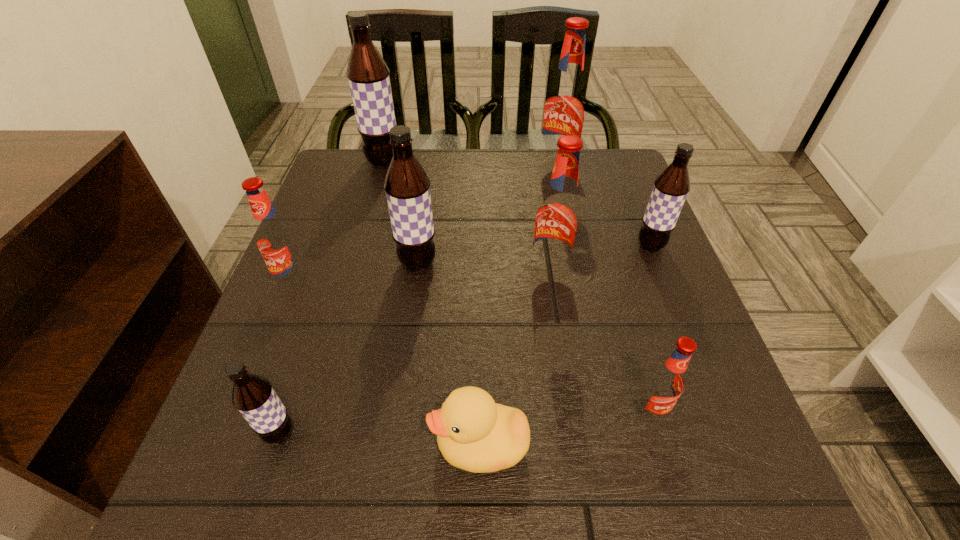
What are the coordinates of `free spot at the right edge of the desktop` in the screenshot? It's located at (695, 318).

The width and height of the screenshot is (960, 540). What are the coordinates of `free space at the far left corner` in the screenshot? It's located at (340, 198).

The height and width of the screenshot is (540, 960). Find the location of `vacant region at the far right corner of the desktop`. vacant region at the far right corner of the desktop is located at coordinates (619, 163).

Identify the location of free space that is in between the second smallest red root beer and the nearest red root beer. The image size is (960, 540). (472, 347).

You are a GUI agent. You are given a task and a screenshot of the screen. Output one action in this format:
    pyautogui.click(x=<x>, y=<y>)
    Task: Click on the vacant region between the yellow duck and the biggest brown root beer
    
    Given the screenshot: What is the action you would take?
    pyautogui.click(x=432, y=303)

I want to click on free space between the third smallest brown root beer and the third smallest red root beer, so click(x=484, y=268).

Where is `free area in between the farthest red root beer and the biggest brown root beer`? This screenshot has height=540, width=960. free area in between the farthest red root beer and the biggest brown root beer is located at coordinates [x=470, y=165].

Locate an element on the screen. The width and height of the screenshot is (960, 540). free spot between the third smallest red root beer and the leftmost root beer is located at coordinates (422, 278).

You are a GUI agent. You are given a task and a screenshot of the screen. Output one action in this format:
    pyautogui.click(x=<x>, y=<y>)
    Task: Click on the empty location between the rightmost root beer and the farthest red root beer
    This screenshot has width=960, height=540.
    Given the screenshot: What is the action you would take?
    pyautogui.click(x=604, y=207)

The height and width of the screenshot is (540, 960). I want to click on unoccupied position between the nearest red root beer and the sixth object from right to left, so 534,337.